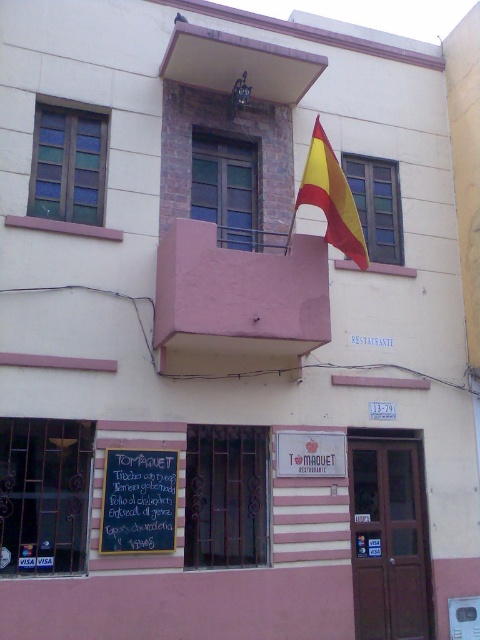
Question: Is black chalkboard at center smaller than yellowmaterial/textureflag at upper center?

Choices:
 (A) no
 (B) yes

Answer: (B)

Question: Is black chalkboard at center below yellowmaterial/textureflag at upper center?

Choices:
 (A) yes
 (B) no

Answer: (A)

Question: Which of the following is the closest to the observer?

Choices:
 (A) (120, 467)
 (B) (340, 248)

Answer: (A)

Question: Which point appears closest to the camera in this image?

Choices:
 (A) (357, 218)
 (B) (117, 484)

Answer: (B)

Question: Does black chalkboard at center appear over yellowmaterial/textureflag at upper center?

Choices:
 (A) yes
 (B) no

Answer: (B)

Question: Which point appears closest to the camera in this image?

Choices:
 (A) coord(337,193)
 (B) coord(165,538)

Answer: (B)